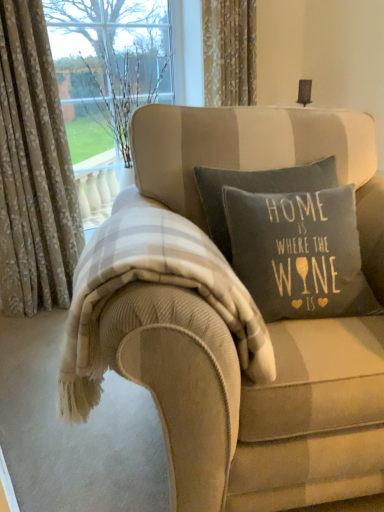
Question: From a real-world perspective, relative to dark gray cotton pillow at center, is beige corduroy couch at center vertically above or below?

Choices:
 (A) below
 (B) above

Answer: (A)

Question: Is beige corduroy couch at center inside the boundaries of dark gray cotton pillow at center, or outside?

Choices:
 (A) inside
 (B) outside

Answer: (B)

Question: Based on their relative distances, which object is farther from the gold textured curtain at upper center, which is the 2th curtain from left to right?

Choices:
 (A) beige corduroy couch at center
 (B) floral-patterned fabric at left, the second curtain from the right
 (C) plaid wool blanket at center
 (D) dark gray cotton pillow at center

Answer: (A)

Question: Which of these objects is positioned farthest from the dark gray cotton pillow at center?

Choices:
 (A) plaid wool blanket at center
 (B) gold textured curtain at upper center, which is the 2th curtain from left to right
 (C) beige corduroy couch at center
 (D) floral-patterned fabric at left, arranged as the first curtain when viewed from the left

Answer: (B)